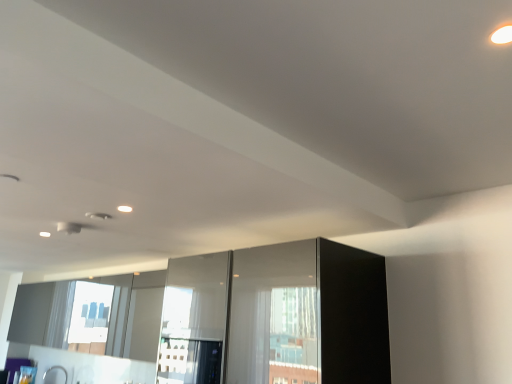
Question: Is transparent glass screen door at center, which ranks as the second screen door in right-to-left order, in front of or behind glossy glass screen door at center, placed as the second screen door when sorted from left to right, in the image?

Choices:
 (A) behind
 (B) front

Answer: (A)

Question: In terms of height, does transparent glass screen door at center, acting as the first screen door starting from the left, look taller or shorter compared to glossy glass screen door at center, placed as the second screen door when sorted from left to right?

Choices:
 (A) tall
 (B) short

Answer: (A)

Question: Which is nearer to the transparent glass screen door at center, which ranks as the second screen door in right-to-left order?

Choices:
 (A) satin nickel faucet at lower left
 (B) glossy glass screen door at center, the 1th screen door positioned from the right

Answer: (B)

Question: Considering the real-world distances, which object is closest to the glossy glass screen door at center, placed as the second screen door when sorted from left to right?

Choices:
 (A) transparent glass screen door at center, acting as the first screen door starting from the left
 (B) satin nickel faucet at lower left

Answer: (A)